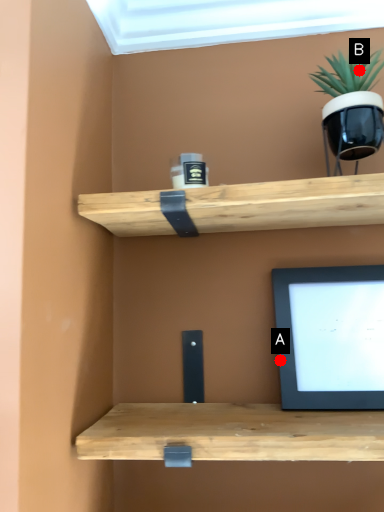
Question: Two points are circled on the image, labeled by A and B beside each circle. Which point is farther to the camera?

Choices:
 (A) A is further
 (B) B is further

Answer: (A)